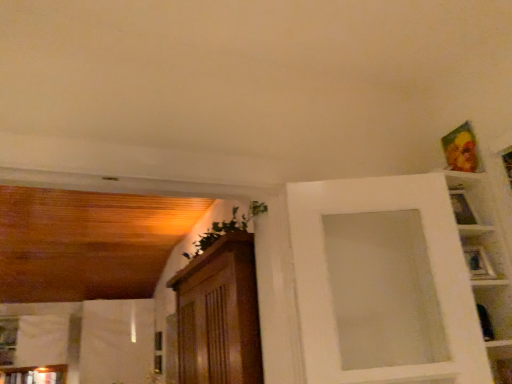
In order to face metallic gold picture frame at upper right, the 2th picture frame from the bottom, should I rotate leftwards or rightwards?

Turn right approximately 25.217 degrees to face it.

Locate an element on the screen. The height and width of the screenshot is (384, 512). metallic gold picture frame at upper right, which appears as the first picture frame when viewed from the top is located at coordinates (461, 149).

Describe the element at coordinates (461, 149) in the screenshot. I see `metallic gold picture frame at upper right, the 2th picture frame from the bottom` at that location.

Where is `metallic silver picture frame at upper right, placed as the 2th picture frame when sorted from top to bottom`? metallic silver picture frame at upper right, placed as the 2th picture frame when sorted from top to bottom is located at coordinates (478, 263).

How much space does metallic silver picture frame at upper right, positioned as the first picture frame in front-to-back order, occupy horizontally?

It is 2.75 inches.

The width and height of the screenshot is (512, 384). What do you see at coordinates (478, 263) in the screenshot? I see `metallic silver picture frame at upper right, positioned as the first picture frame in front-to-back order` at bounding box center [478, 263].

Where is `metallic gold picture frame at upper right, acting as the first picture frame starting from the back`? metallic gold picture frame at upper right, acting as the first picture frame starting from the back is located at coordinates (461, 149).

Which object is positioned more to the right, metallic gold picture frame at upper right, which appears as the first picture frame when viewed from the top, or metallic silver picture frame at upper right, which is the 2th picture frame in back-to-front order?

metallic gold picture frame at upper right, which appears as the first picture frame when viewed from the top.

Consider the image. Is the depth of metallic gold picture frame at upper right, which appears as the first picture frame when viewed from the top, greater than that of metallic silver picture frame at upper right, which is the 2th picture frame in back-to-front order?

Yes, the depth of metallic gold picture frame at upper right, which appears as the first picture frame when viewed from the top, is greater than that of metallic silver picture frame at upper right, which is the 2th picture frame in back-to-front order.

Does point (472, 153) come behind point (475, 251)?

That is True.

From the image's perspective, who appears lower, metallic gold picture frame at upper right, the 2th picture frame from the bottom, or metallic silver picture frame at upper right, which is the 2th picture frame in back-to-front order?

From the image's view, metallic silver picture frame at upper right, which is the 2th picture frame in back-to-front order, is below.

From a real-world perspective, is metallic gold picture frame at upper right, the 2th picture frame from the bottom, physically located above or below metallic silver picture frame at upper right, placed as the 2th picture frame when sorted from top to bottom?

metallic gold picture frame at upper right, the 2th picture frame from the bottom, is situated higher than metallic silver picture frame at upper right, placed as the 2th picture frame when sorted from top to bottom, in the real world.

Considering the relative sizes of metallic gold picture frame at upper right, the 2th picture frame from the bottom, and metallic silver picture frame at upper right, placed as the 2th picture frame when sorted from top to bottom, in the image provided, is metallic gold picture frame at upper right, the 2th picture frame from the bottom, thinner than metallic silver picture frame at upper right, placed as the 2th picture frame when sorted from top to bottom,?

Indeed, metallic gold picture frame at upper right, the 2th picture frame from the bottom, has a lesser width compared to metallic silver picture frame at upper right, placed as the 2th picture frame when sorted from top to bottom.

Can you confirm if metallic gold picture frame at upper right, acting as the first picture frame starting from the back, is shorter than metallic silver picture frame at upper right, positioned as the first picture frame in front-to-back order?

Incorrect, the height of metallic gold picture frame at upper right, acting as the first picture frame starting from the back, does not fall short of that of metallic silver picture frame at upper right, positioned as the first picture frame in front-to-back order.

Considering the sizes of metallic gold picture frame at upper right, which appears as the first picture frame when viewed from the top, and metallic silver picture frame at upper right, positioned as the first picture frame in front-to-back order, in the image, is metallic gold picture frame at upper right, which appears as the first picture frame when viewed from the top, bigger or smaller than metallic silver picture frame at upper right, positioned as the first picture frame in front-to-back order,?

Considering their sizes, metallic gold picture frame at upper right, which appears as the first picture frame when viewed from the top, takes up more space than metallic silver picture frame at upper right, positioned as the first picture frame in front-to-back order.

In the scene shown: Is metallic gold picture frame at upper right, the 2th picture frame from the bottom, not inside metallic silver picture frame at upper right, which is the 2th picture frame in back-to-front order?

Indeed, metallic gold picture frame at upper right, the 2th picture frame from the bottom, is completely outside metallic silver picture frame at upper right, which is the 2th picture frame in back-to-front order.

Is metallic gold picture frame at upper right, which appears as the first picture frame when viewed from the top, far from metallic silver picture frame at upper right, which is the 2th picture frame in back-to-front order?

metallic gold picture frame at upper right, which appears as the first picture frame when viewed from the top, is near metallic silver picture frame at upper right, which is the 2th picture frame in back-to-front order, not far away.

Is metallic gold picture frame at upper right, the 2th picture frame from the bottom, looking in the opposite direction of metallic silver picture frame at upper right, marked as the 1th picture frame in a bottom-to-top arrangement?

No, metallic gold picture frame at upper right, the 2th picture frame from the bottom, is not facing the opposite direction of metallic silver picture frame at upper right, marked as the 1th picture frame in a bottom-to-top arrangement.

How many degrees apart are the facing directions of metallic gold picture frame at upper right, the second picture frame when ordered from front to back, and metallic silver picture frame at upper right, which is the 2th picture frame in back-to-front order?

The angular difference between metallic gold picture frame at upper right, the second picture frame when ordered from front to back, and metallic silver picture frame at upper right, which is the 2th picture frame in back-to-front order, is 90 degrees.

Measure the distance from metallic gold picture frame at upper right, the second picture frame when ordered from front to back, to metallic silver picture frame at upper right, positioned as the first picture frame in front-to-back order.

metallic gold picture frame at upper right, the second picture frame when ordered from front to back, and metallic silver picture frame at upper right, positioned as the first picture frame in front-to-back order, are 13.48 inches apart from each other.

At what (x,y) coordinates should I click in order to perform the action: click on picture frame that appears on the left of metallic gold picture frame at upper right, the second picture frame when ordered from front to back. Please return your answer as a coordinate pair (x, y). The height and width of the screenshot is (384, 512). Looking at the image, I should click on (478, 263).

Can you confirm if metallic silver picture frame at upper right, which is the 2th picture frame in back-to-front order, is positioned to the right of metallic gold picture frame at upper right, the 2th picture frame from the bottom?

No.

Is metallic silver picture frame at upper right, positioned as the first picture frame in front-to-back order, in front of or behind metallic gold picture frame at upper right, the 2th picture frame from the bottom, in the image?

metallic silver picture frame at upper right, positioned as the first picture frame in front-to-back order, is in front of metallic gold picture frame at upper right, the 2th picture frame from the bottom.

Does point (488, 271) appear closer or farther from the camera than point (469, 156)?

Clearly, point (488, 271) is closer to the camera than point (469, 156).

From the image's perspective, would you say metallic silver picture frame at upper right, placed as the 2th picture frame when sorted from top to bottom, is positioned over metallic gold picture frame at upper right, acting as the first picture frame starting from the back?

No, from the image's perspective, metallic silver picture frame at upper right, placed as the 2th picture frame when sorted from top to bottom, is not over metallic gold picture frame at upper right, acting as the first picture frame starting from the back.

From a real-world perspective, is metallic silver picture frame at upper right, marked as the 1th picture frame in a bottom-to-top arrangement, physically located above or below metallic gold picture frame at upper right, which appears as the first picture frame when viewed from the top?

In terms of real-world spatial position, metallic silver picture frame at upper right, marked as the 1th picture frame in a bottom-to-top arrangement, is below metallic gold picture frame at upper right, which appears as the first picture frame when viewed from the top.

Which object is thinner, metallic silver picture frame at upper right, placed as the 2th picture frame when sorted from top to bottom, or metallic gold picture frame at upper right, the second picture frame when ordered from front to back?

metallic gold picture frame at upper right, the second picture frame when ordered from front to back.

Considering the sizes of metallic silver picture frame at upper right, positioned as the first picture frame in front-to-back order, and metallic gold picture frame at upper right, acting as the first picture frame starting from the back, in the image, is metallic silver picture frame at upper right, positioned as the first picture frame in front-to-back order, taller or shorter than metallic gold picture frame at upper right, acting as the first picture frame starting from the back,?

Considering their sizes, metallic silver picture frame at upper right, positioned as the first picture frame in front-to-back order, has less height than metallic gold picture frame at upper right, acting as the first picture frame starting from the back.

In terms of size, does metallic silver picture frame at upper right, placed as the 2th picture frame when sorted from top to bottom, appear bigger or smaller than metallic gold picture frame at upper right, the 2th picture frame from the bottom?

metallic silver picture frame at upper right, placed as the 2th picture frame when sorted from top to bottom, is smaller than metallic gold picture frame at upper right, the 2th picture frame from the bottom.

Based on the photo, is metallic silver picture frame at upper right, which is the 2th picture frame in back-to-front order, situated inside metallic gold picture frame at upper right, which appears as the first picture frame when viewed from the top, or outside?

metallic silver picture frame at upper right, which is the 2th picture frame in back-to-front order, is spatially situated outside metallic gold picture frame at upper right, which appears as the first picture frame when viewed from the top.

Are metallic silver picture frame at upper right, placed as the 2th picture frame when sorted from top to bottom, and metallic gold picture frame at upper right, which appears as the first picture frame when viewed from the top, far apart?

No.

Consider the image. Could you tell me if metallic silver picture frame at upper right, placed as the 2th picture frame when sorted from top to bottom, is facing metallic gold picture frame at upper right, acting as the first picture frame starting from the back?

No, metallic silver picture frame at upper right, placed as the 2th picture frame when sorted from top to bottom, does not turn towards metallic gold picture frame at upper right, acting as the first picture frame starting from the back.

Can you tell me how much metallic silver picture frame at upper right, placed as the 2th picture frame when sorted from top to bottom, and metallic gold picture frame at upper right, the second picture frame when ordered from front to back, differ in facing direction?

The angle between the facing direction of metallic silver picture frame at upper right, placed as the 2th picture frame when sorted from top to bottom, and the facing direction of metallic gold picture frame at upper right, the second picture frame when ordered from front to back, is 90 degrees.

Find the location of a particular element. picture frame that appears on the left of metallic gold picture frame at upper right, which appears as the first picture frame when viewed from the top is located at coordinates (478, 263).

Find the location of a particular element. picture frame behind the metallic silver picture frame at upper right, positioned as the first picture frame in front-to-back order is located at coordinates (461, 149).

The height and width of the screenshot is (384, 512). I want to click on picture frame above the metallic silver picture frame at upper right, positioned as the first picture frame in front-to-back order (from the image's perspective), so click(461, 149).